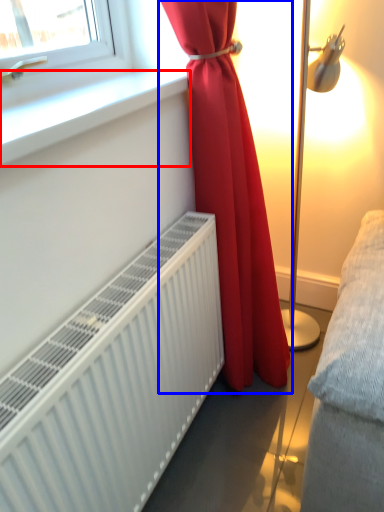
Question: Which object appears closest to the camera in this image, window sill (highlighted by a red box) or curtain (highlighted by a blue box)?

Choices:
 (A) window sill
 (B) curtain

Answer: (A)